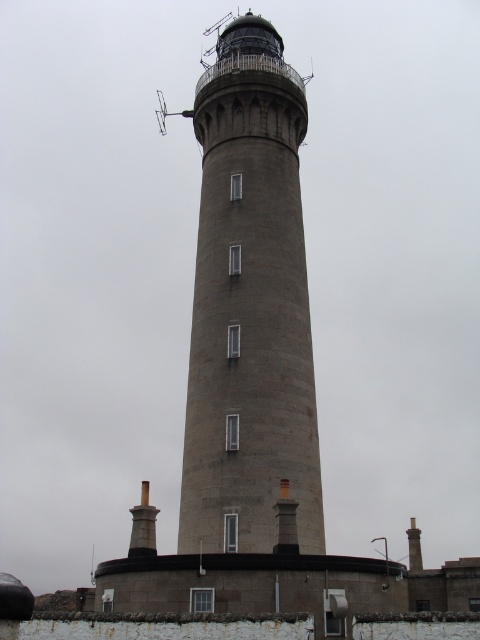
Question: Considering the relative positions of dark gray stone chimney at center and smooth gray chimney at center in the image provided, where is dark gray stone chimney at center located with respect to smooth gray chimney at center?

Choices:
 (A) above
 (B) below

Answer: (B)

Question: Does gray stone tower at center appear under dark gray stone chimney at center?

Choices:
 (A) no
 (B) yes

Answer: (A)

Question: Observing the image, what is the correct spatial positioning of dark gray stone chimney at center in reference to dark gray stone chimney at lower right?

Choices:
 (A) above
 (B) below

Answer: (A)

Question: Which of the following is the farthest from the observer?

Choices:
 (A) (244, 42)
 (B) (141, 513)

Answer: (A)

Question: Which object is the closest to the smooth gray chimney at center?

Choices:
 (A) dark gray stone chimney at center
 (B) gray stone tower at center
 (C) dark gray stone chimney at lower right

Answer: (A)

Question: Which point is closer to the camera?

Choices:
 (A) dark gray stone chimney at center
 (B) gray stone tower at center
 (C) smooth gray chimney at center
 (D) dark gray stone chimney at lower right

Answer: (C)